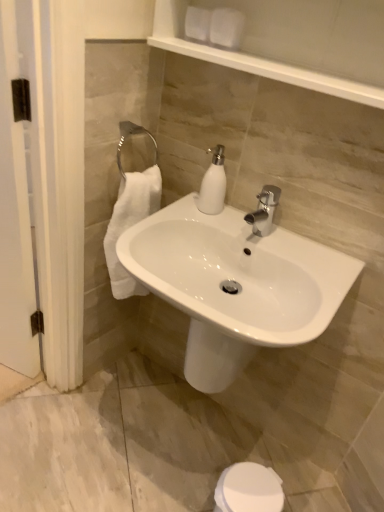
Identify the location of vacant region in front of white glossy soap dispenser at center. (203, 224).